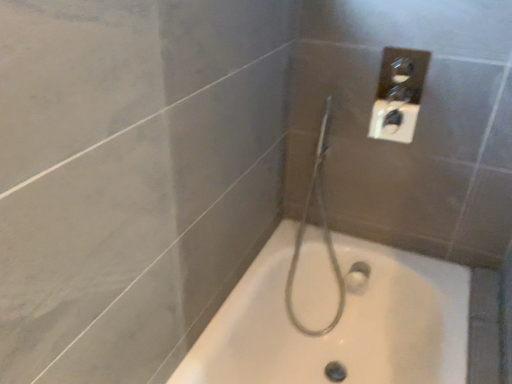
Question: Considering the positions of point (298, 369) and point (339, 284), is point (298, 369) closer or farther from the camera than point (339, 284)?

Choices:
 (A) closer
 (B) farther

Answer: (A)

Question: Considering the positions of white glossy bathtub at center and silver metallic shower head at center in the image, is white glossy bathtub at center taller or shorter than silver metallic shower head at center?

Choices:
 (A) tall
 (B) short

Answer: (B)

Question: Is white glossy bathtub at center wider or thinner than silver metallic shower head at center?

Choices:
 (A) thin
 (B) wide

Answer: (B)

Question: Is silver metallic shower head at center to the left or to the right of white glossy bathtub at center in the image?

Choices:
 (A) right
 (B) left

Answer: (B)

Question: Looking at their shapes, would you say silver metallic shower head at center is wider or thinner than white glossy bathtub at center?

Choices:
 (A) thin
 (B) wide

Answer: (A)

Question: Looking at the image, does silver metallic shower head at center seem bigger or smaller compared to white glossy bathtub at center?

Choices:
 (A) small
 (B) big

Answer: (A)

Question: Considering the positions of silver metallic shower head at center and white glossy bathtub at center in the image, is silver metallic shower head at center taller or shorter than white glossy bathtub at center?

Choices:
 (A) tall
 (B) short

Answer: (A)